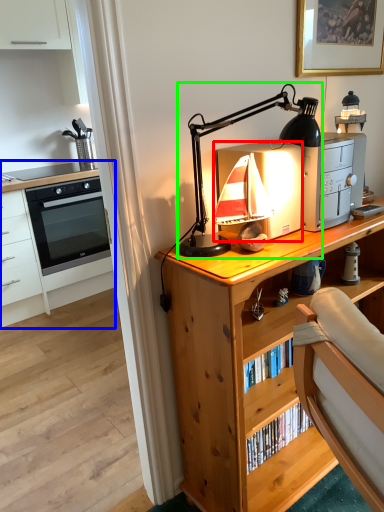
Question: Based on their relative distances, which object is farther from appliance (highlighted by a red box)? Choose from chest of drawers (highlighted by a blue box) and lamp (highlighted by a green box).

Choices:
 (A) chest of drawers
 (B) lamp

Answer: (A)